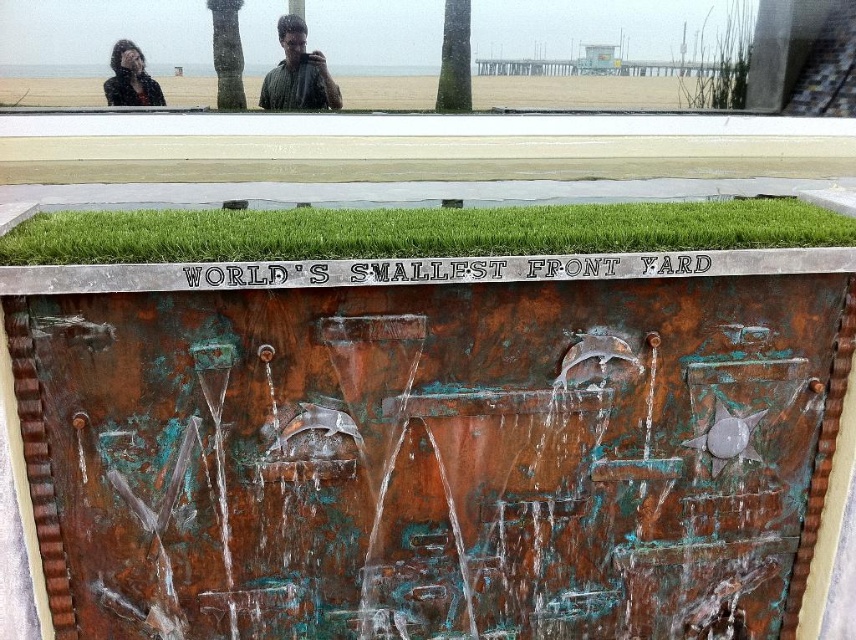
From the picture: You are a maintenance worker who needs to reach both the rusty metal sign at center and the green textured palm tree at upper center. If your ladder is 4 feet long, can you safely reach both objects without moving the ladder?

The distance between the rusty metal sign at center and the green textured palm tree at upper center is 4.21 feet. Since the ladder is only 4 feet long, it is not long enough to cover the 4.21 feet gap. Therefore, you would need to move the ladder to reach both objects safely.

You are an artist planning to add a new element to the installation. You have a small sculpture that needs to be placed between the rusty metal sign at center and the green textured palm tree at upper center. Considering their sizes, which object should the sculpture be placed closer to?

The sculpture should be placed closer to the green textured palm tree at upper center because the rusty metal sign at center is bigger than the green textured palm tree at upper center, so the palm tree is smaller and requires less space around it.